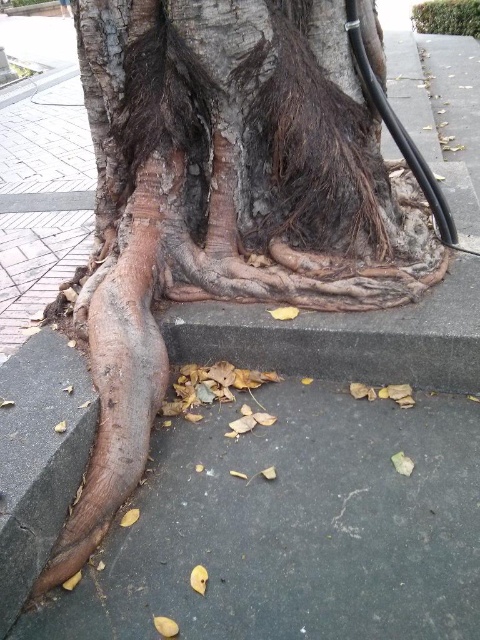
Question: Among these objects, which one is farthest from the camera?

Choices:
 (A) brown rough pavement at lower left
 (B) brown rough bark at center

Answer: (B)

Question: Can you confirm if brown rough pavement at lower left is bigger than brown rough bark at center?

Choices:
 (A) yes
 (B) no

Answer: (A)

Question: Which point is closer to the camera?

Choices:
 (A) (305, 234)
 (B) (465, 595)

Answer: (B)

Question: Observing the image, what is the correct spatial positioning of brown rough pavement at lower left in reference to brown rough bark at center?

Choices:
 (A) below
 (B) above

Answer: (A)

Question: Which object is closer to the camera taking this photo?

Choices:
 (A) brown rough pavement at lower left
 (B) brown rough bark at center

Answer: (A)

Question: Is brown rough pavement at lower left wider than brown rough bark at center?

Choices:
 (A) yes
 (B) no

Answer: (A)